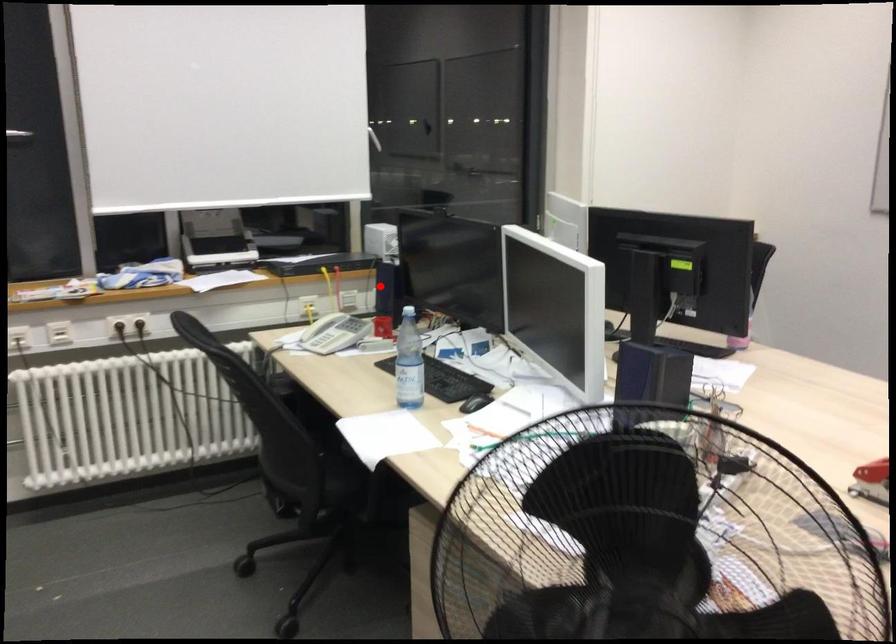
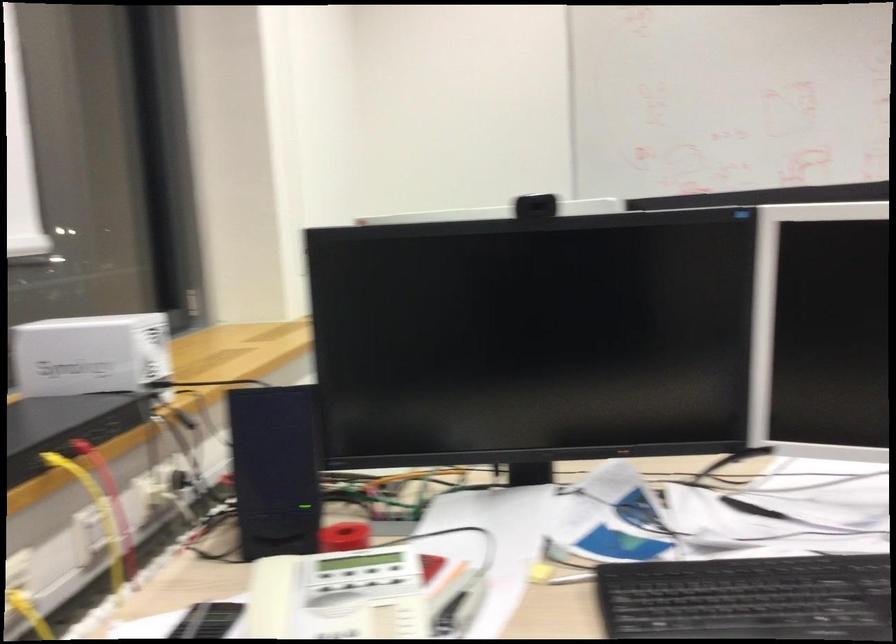
In the second image, find the point that corresponds to the highlighted location in the first image.

(274, 469)